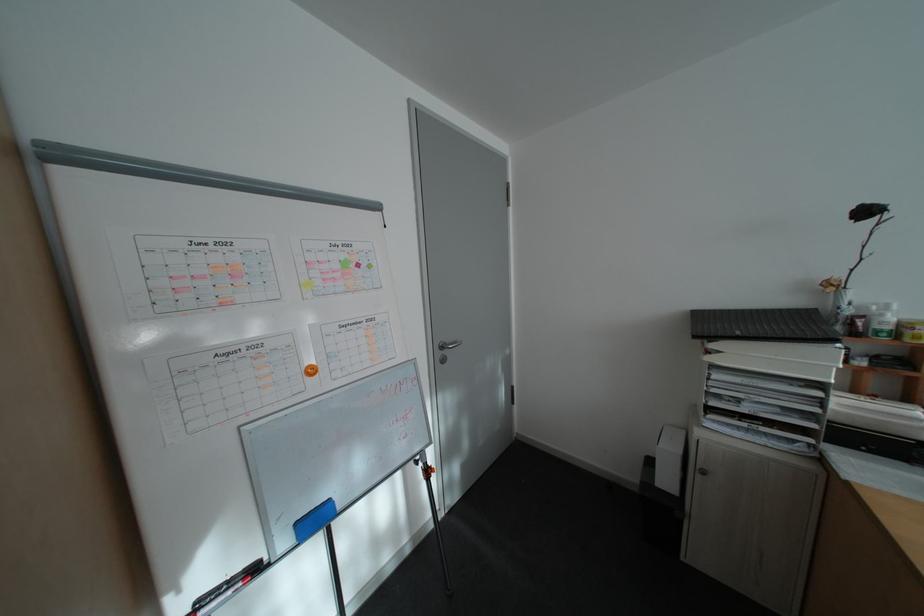
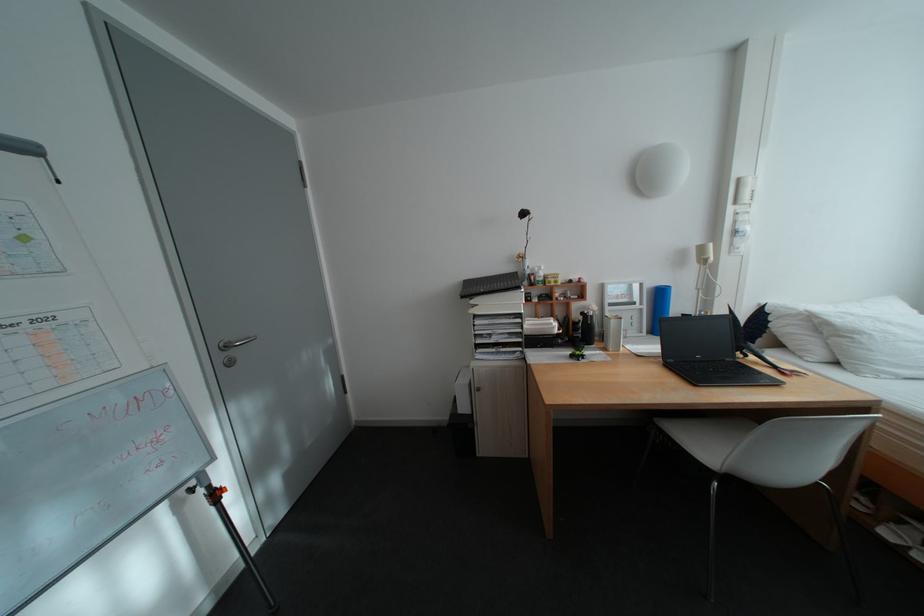
Question: Based on the continuous images, in which direction is the camera rotating? Reply with the corresponding letter.

Choices:
 (A) Left
 (B) Right
 (C) Up
 (D) Down

Answer: (B)